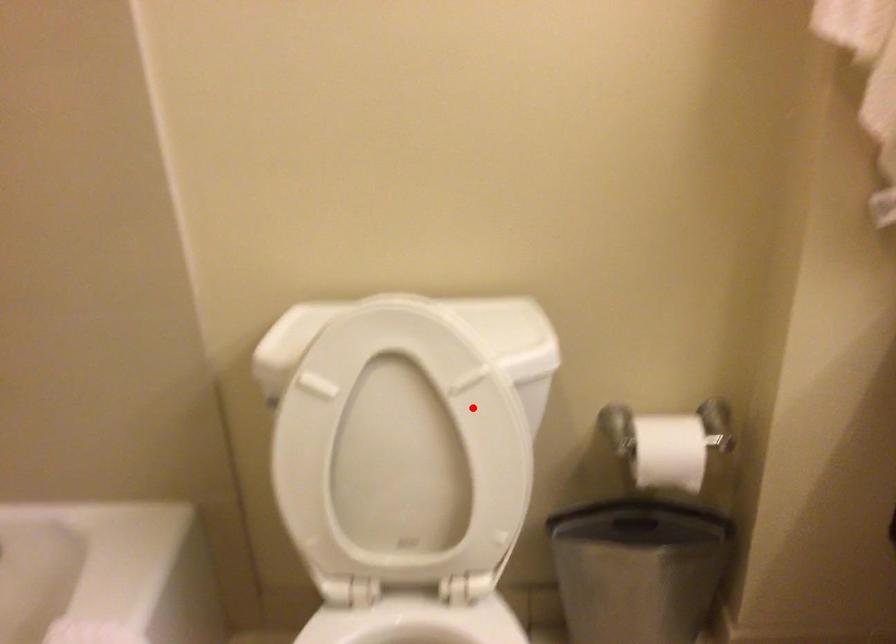
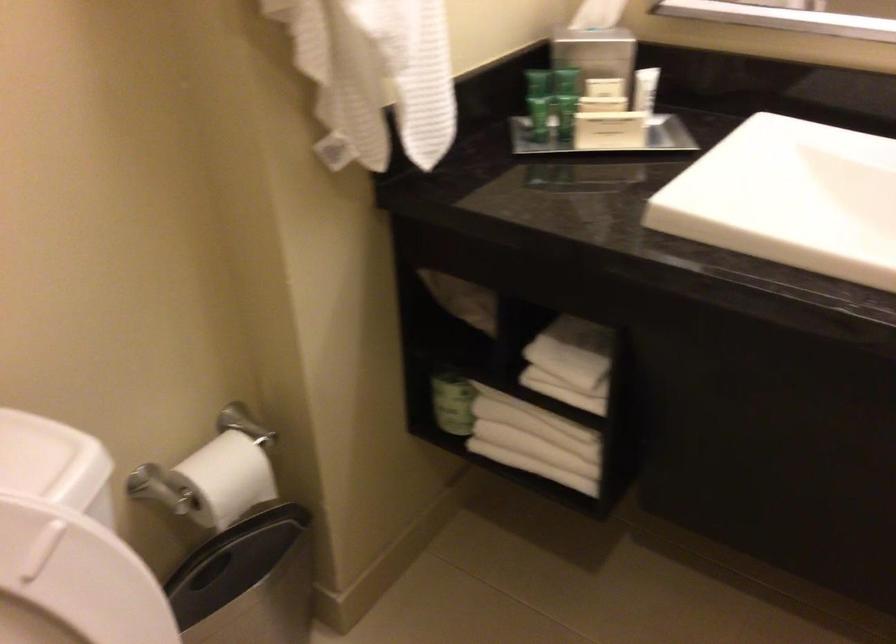
Where in the second image is the point corresponding to the highlighted location from the first image?

(73, 582)